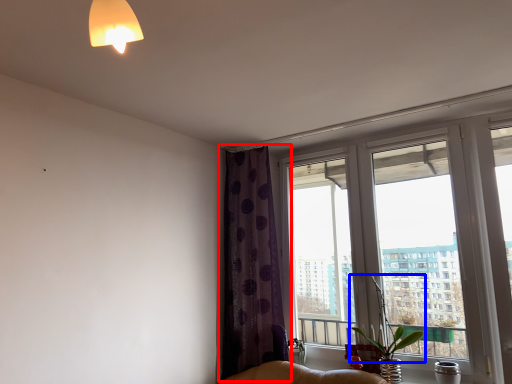
Question: Among these objects, which one is farthest to the camera, curtain (highlighted by a red box) or plant (highlighted by a blue box)?

Choices:
 (A) curtain
 (B) plant

Answer: (A)